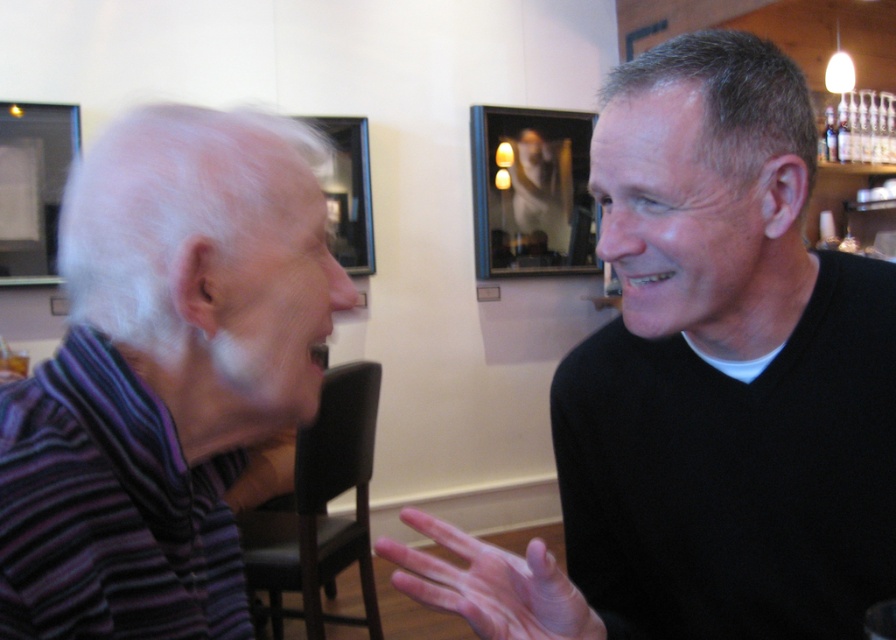
You are a photographer setting up a shoot in this scene. You want to ensure both the black matte sweater at center and the purple striped sweater at left are clearly visible in the photo. Given their positions, which sweater might partially obscure the other, and how could you adjust your camera angle to avoid this?

The purple striped sweater at left is behind the black matte sweater at center, so the black matte sweater at center might partially obscure the purple striped sweater at left. To avoid this, adjust the camera angle to position the black matte sweater at center slightly to the side so the purple striped sweater at left becomes more visible.

You are a tailor measuring garments for alterations. You have a customer who wants to know if their black matte sweater at center can fit over their purple striped sweater at left without bunching. Based on the image, can you determine if this is possible?

The black matte sweater at center is wider than the purple striped sweater at left, so it may not fit over without bunching since it is wider.